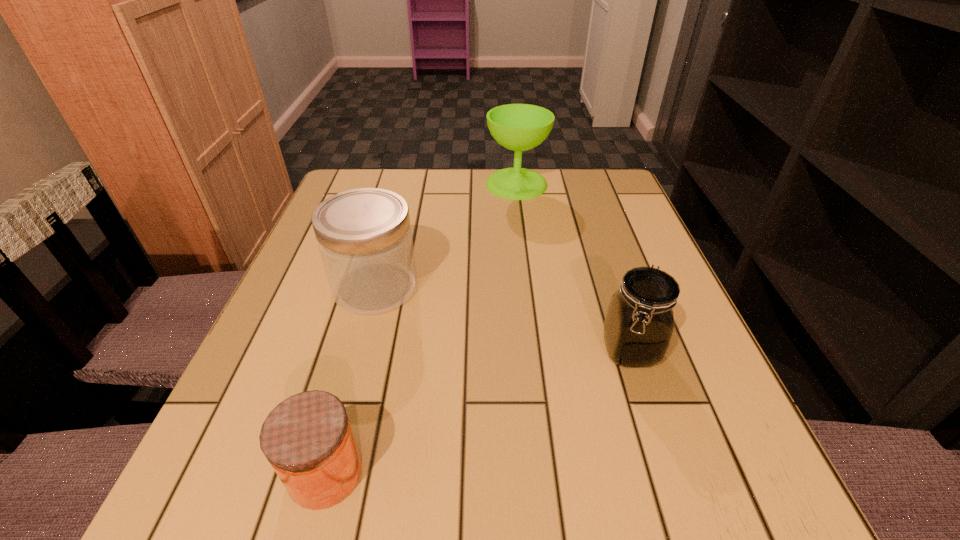
Where is `the second object from right to left`? the second object from right to left is located at coordinates (519, 127).

Locate an element on the screen. The height and width of the screenshot is (540, 960). the farthest object is located at coordinates (519, 127).

The height and width of the screenshot is (540, 960). I want to click on the third nearest object, so click(364, 236).

You are a GUI agent. You are given a task and a screenshot of the screen. Output one action in this format:
    pyautogui.click(x=<x>, y=<y>)
    Task: Click on the second nearest jar
    The height and width of the screenshot is (540, 960).
    Given the screenshot: What is the action you would take?
    pyautogui.click(x=639, y=324)

At what (x,y) coordinates should I click in order to perform the action: click on the rightmost object. Please return your answer as a coordinate pair (x, y). This screenshot has width=960, height=540. Looking at the image, I should click on 639,324.

Find the location of a particular element. This screenshot has width=960, height=540. the nearest object is located at coordinates (307, 438).

I want to click on the nearest jar, so click(307, 438).

Where is `free region located 0.090m on the front of the farthest object`? free region located 0.090m on the front of the farthest object is located at coordinates (521, 220).

Locate an element on the screen. vacant point located on the front of the third nearest object is located at coordinates pyautogui.click(x=351, y=379).

At what (x,y) coordinates should I click in order to perform the action: click on vacant area situated 0.160m on the lid of the rightmost jar. Please return your answer as a coordinate pair (x, y). This screenshot has height=540, width=960. Looking at the image, I should click on (670, 474).